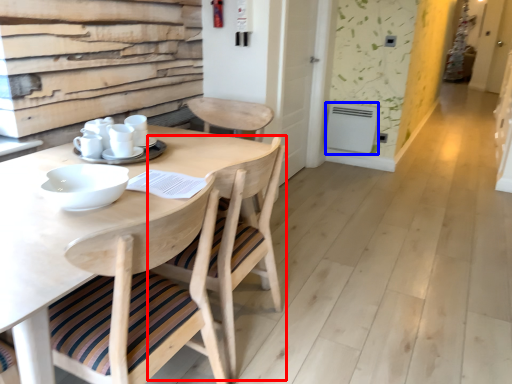
Question: Among these objects, which one is nearest to the camera, chair (highlighted by a red box) or appliance (highlighted by a blue box)?

Choices:
 (A) chair
 (B) appliance

Answer: (A)